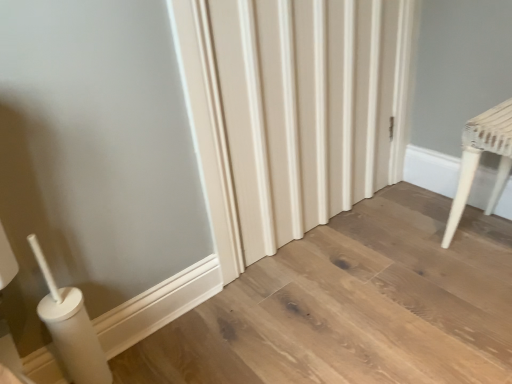
This screenshot has height=384, width=512. What do you see at coordinates (305, 110) in the screenshot?
I see `white textured radiator at center` at bounding box center [305, 110].

This screenshot has width=512, height=384. I want to click on white textured radiator at center, so click(305, 110).

Describe the element at coordinates (479, 160) in the screenshot. The width and height of the screenshot is (512, 384). I see `white woven stool at right` at that location.

The width and height of the screenshot is (512, 384). I want to click on white woven stool at right, so click(x=479, y=160).

What are the coordinates of `white textured radiator at center` in the screenshot? It's located at (305, 110).

Considering the relative positions of white woven stool at right and white textured radiator at center in the image provided, is white woven stool at right to the left or to the right of white textured radiator at center?

In the image, white woven stool at right appears on the right side of white textured radiator at center.

Who is more distant, white woven stool at right or white textured radiator at center?

white woven stool at right.

Is point (507, 166) closer to viewer compared to point (362, 149)?

Yes, it is in front of point (362, 149).

From the image's perspective, which is below, white woven stool at right or white textured radiator at center?

white woven stool at right.

From a real-world perspective, which is physically below, white woven stool at right or white textured radiator at center?

In real-world perspective, white woven stool at right is lower.

In terms of width, does white woven stool at right look wider or thinner when compared to white textured radiator at center?

white woven stool at right is wider than white textured radiator at center.

Between white woven stool at right and white textured radiator at center, which one has more height?

white textured radiator at center.

Can you confirm if white woven stool at right is bigger than white textured radiator at center?

Incorrect, white woven stool at right is not larger than white textured radiator at center.

Consider the image. Is white woven stool at right inside the boundaries of white textured radiator at center, or outside?

white woven stool at right is outside white textured radiator at center.

Consider the image. Is white woven stool at right next to white textured radiator at center?

No.

Is white woven stool at right turned away from white textured radiator at center?

white woven stool at right does not have its back to white textured radiator at center.

How different are the orientations of white woven stool at right and white textured radiator at center in degrees?

90.1 degrees.

From the picture: How much distance is there between white woven stool at right and white textured radiator at center?

20.39 inches.

Find the location of `radiator above the white woven stool at right (from the image's perspective)`. radiator above the white woven stool at right (from the image's perspective) is located at coordinates (305, 110).

Based on the photo, considering the positions of objects white textured radiator at center and white woven stool at right in the image provided, who is more to the right, white textured radiator at center or white woven stool at right?

From the viewer's perspective, white woven stool at right appears more on the right side.

In the image, is white textured radiator at center positioned in front of or behind white woven stool at right?

Clearly, white textured radiator at center is in front of white woven stool at right.

Which is closer to the camera, (319, 88) or (446, 228)?

Clearly, point (319, 88) is closer to the camera than point (446, 228).

From the image's perspective, which is above, white textured radiator at center or white woven stool at right?

white textured radiator at center appears higher in the image.

From a real-world perspective, which object rests below the other?

From a 3D spatial view, white woven stool at right is below.

Which of these two, white textured radiator at center or white woven stool at right, is wider?

With larger width is white woven stool at right.

Considering the sizes of white textured radiator at center and white woven stool at right in the image, is white textured radiator at center taller or shorter than white woven stool at right?

white textured radiator at center is taller than white woven stool at right.

Is white textured radiator at center bigger than white woven stool at right?

Yes.

Is white textured radiator at center surrounding white woven stool at right?

No, white woven stool at right is not surrounded by white textured radiator at center.

Is white textured radiator at center beside white woven stool at right?

No, white textured radiator at center is not next to white woven stool at right.

Could you tell me if white textured radiator at center is turned towards white woven stool at right?

Yes, white textured radiator at center is turned towards white woven stool at right.

Locate an element on the screen. radiator in front of the white woven stool at right is located at coordinates (305, 110).

You are a GUI agent. You are given a task and a screenshot of the screen. Output one action in this format:
    pyautogui.click(x=<x>, y=<y>)
    Task: Click on the radiator above the white woven stool at right (from the image's perspective)
    The image size is (512, 384).
    Given the screenshot: What is the action you would take?
    pyautogui.click(x=305, y=110)

At what (x,y) coordinates should I click in order to perform the action: click on furniture below the white textured radiator at center (from the image's perspective). Please return your answer as a coordinate pair (x, y). This screenshot has width=512, height=384. Looking at the image, I should click on (479, 160).